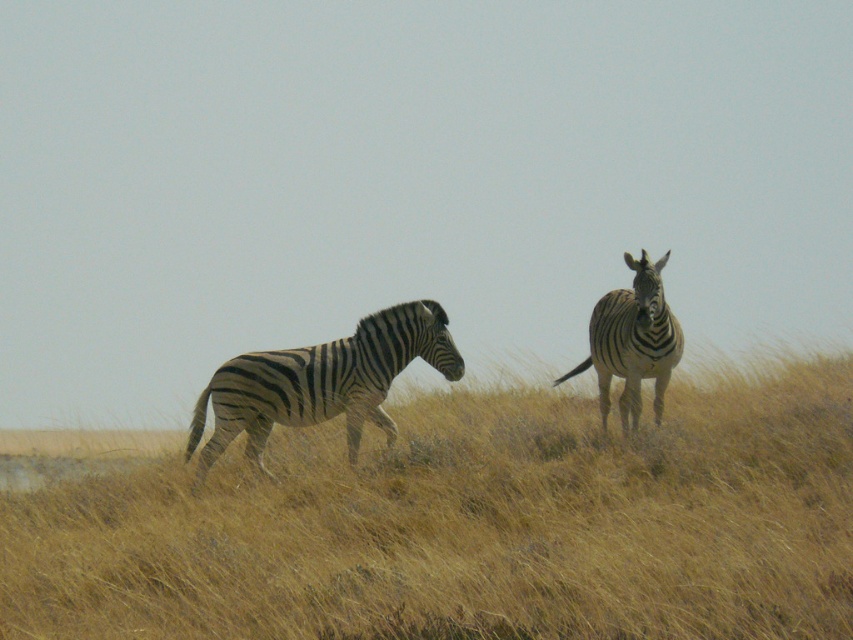
You are an animal tracker analyzing the image. You need to determine the exact 2D coordinates of the dry grass at center to mark its location on a map. What are the coordinates?

The dry grass at center is located at coordinates point (x=469, y=525).

You are a wildlife photographer trying to capture a photo of both zebras in the frame. Given that the black and white striped zebra at left is closer to you than the black and white striped zebra at upper right, which zebra would appear larger in your photo?

The black and white striped zebra at left would appear larger in the photo because it is closer to the photographer than the black and white striped zebra at upper right.